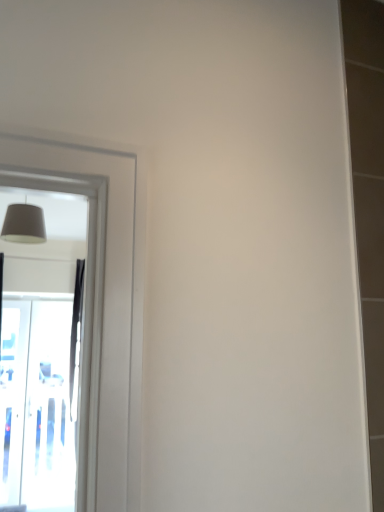
Question: Can you confirm if transparent glass screen door at left is smaller than matte gray lampshade at upper left?

Choices:
 (A) yes
 (B) no

Answer: (B)

Question: Does transparent glass screen door at left come behind matte gray lampshade at upper left?

Choices:
 (A) no
 (B) yes

Answer: (B)

Question: Does transparent glass screen door at left turn towards matte gray lampshade at upper left?

Choices:
 (A) yes
 (B) no

Answer: (A)

Question: From a real-world perspective, is transparent glass screen door at left beneath matte gray lampshade at upper left?

Choices:
 (A) yes
 (B) no

Answer: (A)

Question: Is transparent glass screen door at left closer to the viewer compared to matte gray lampshade at upper left?

Choices:
 (A) yes
 (B) no

Answer: (B)

Question: Does transparent glass screen door at left have a lesser height compared to matte gray lampshade at upper left?

Choices:
 (A) no
 (B) yes

Answer: (A)

Question: From a real-world perspective, does matte gray lampshade at upper left sit lower than transparent glass screen door at left?

Choices:
 (A) no
 (B) yes

Answer: (A)

Question: Can you confirm if matte gray lampshade at upper left is positioned to the left of transparent glass screen door at left?

Choices:
 (A) no
 (B) yes

Answer: (A)

Question: Is matte gray lampshade at upper left located outside transparent glass screen door at left?

Choices:
 (A) yes
 (B) no

Answer: (A)

Question: Does matte gray lampshade at upper left have a lesser width compared to transparent glass screen door at left?

Choices:
 (A) no
 (B) yes

Answer: (A)

Question: Is matte gray lampshade at upper left smaller than transparent glass screen door at left?

Choices:
 (A) no
 (B) yes

Answer: (B)

Question: Is matte gray lampshade at upper left far away from transparent glass screen door at left?

Choices:
 (A) no
 (B) yes

Answer: (B)

Question: Is matte gray lampshade at upper left bigger or smaller than transparent glass screen door at left?

Choices:
 (A) small
 (B) big

Answer: (A)